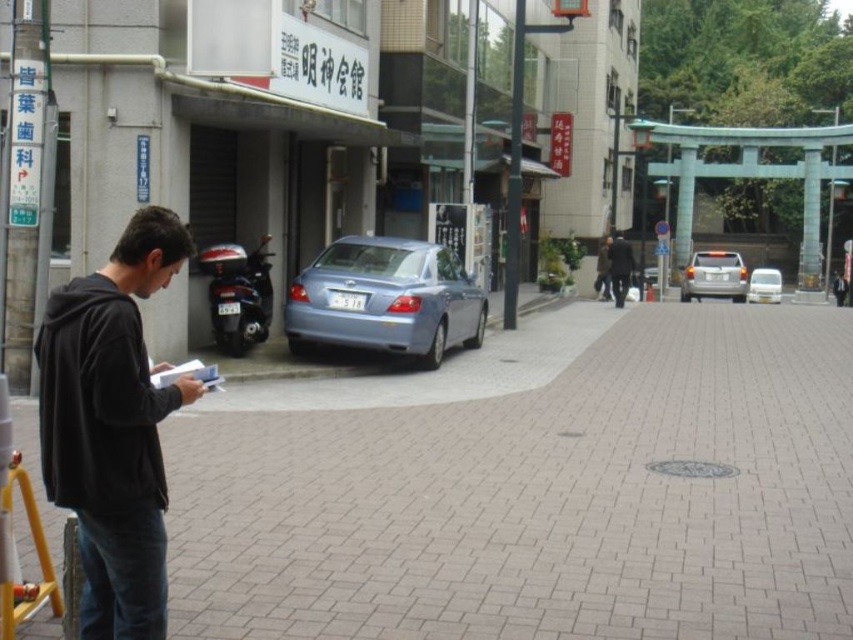
You are a tailor measuring jackets for a customer. You have two jackets in front of you, the dark gray jacket at center and the dark brown leather jacket at center. Which jacket has a larger width measurement?

The dark gray jacket at center has a larger width measurement than the dark brown leather jacket at center according to the description.